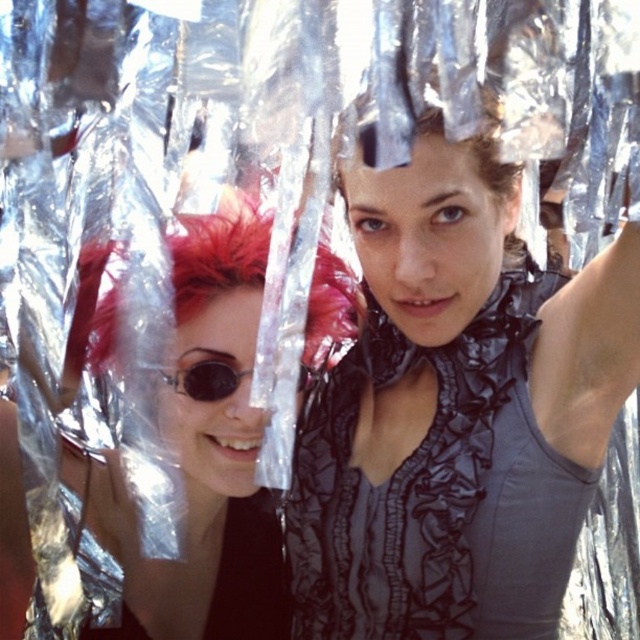
Question: Which of these objects is positioned closest to the shiny red hair at left?

Choices:
 (A) sunglasses at center
 (B) vivid red hair at center
 (C) matte black dress at center
 (D) shiny silver hair at center

Answer: (B)

Question: Estimate the real-world distances between objects in this image. Which object is closer to the sunglasses at center?

Choices:
 (A) shiny silver hair at center
 (B) matte black dress at center
 (C) shiny red hair at left

Answer: (C)

Question: Is matte black dress at center above shiny silver hair at center?

Choices:
 (A) yes
 (B) no

Answer: (B)

Question: Which point is farther to the camera?

Choices:
 (A) matte black dress at center
 (B) shiny silver hair at center
 (C) shiny red hair at left

Answer: (C)

Question: Is shiny red hair at left smaller than sunglasses at center?

Choices:
 (A) no
 (B) yes

Answer: (A)

Question: Observing the image, what is the correct spatial positioning of matte black dress at center in reference to shiny red hair at left?

Choices:
 (A) right
 (B) left

Answer: (A)